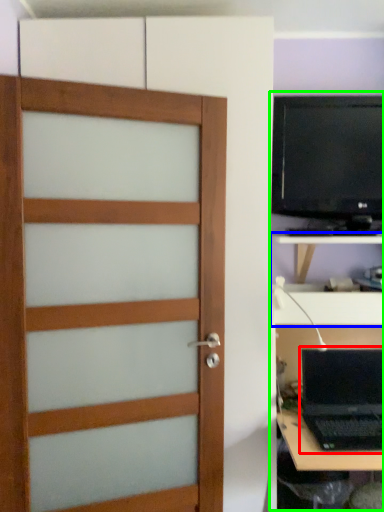
Question: Estimate the real-world distances between objects in this image. Which object is closer to laptop (highlighted by a red box), tv cabinet (highlighted by a blue box) or entertainment center (highlighted by a green box)?

Choices:
 (A) tv cabinet
 (B) entertainment center

Answer: (A)